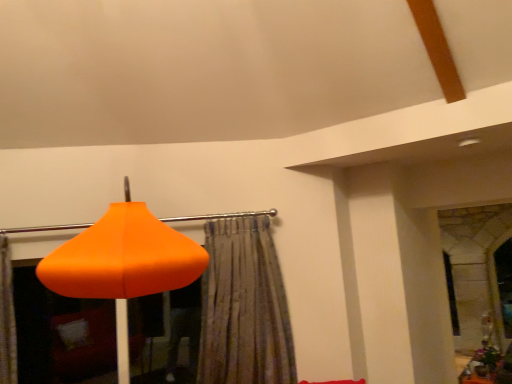
Question: Considering the relative sizes of orange matte lampshade at lower left and textured beige curtain at center in the image provided, is orange matte lampshade at lower left thinner than textured beige curtain at center?

Choices:
 (A) no
 (B) yes

Answer: (A)

Question: From the image's perspective, does orange matte lampshade at lower left appear lower than textured beige curtain at center?

Choices:
 (A) no
 (B) yes

Answer: (A)

Question: Is orange matte lampshade at lower left looking in the opposite direction of textured beige curtain at center?

Choices:
 (A) no
 (B) yes

Answer: (A)

Question: Are orange matte lampshade at lower left and textured beige curtain at center located far from each other?

Choices:
 (A) no
 (B) yes

Answer: (B)

Question: Does orange matte lampshade at lower left contain textured beige curtain at center?

Choices:
 (A) yes
 (B) no

Answer: (A)

Question: Is orange matte lampshade at lower left in front of or behind wooden textured table at lower right in the image?

Choices:
 (A) front
 (B) behind

Answer: (A)

Question: From the image's perspective, is orange matte lampshade at lower left located above or below wooden textured table at lower right?

Choices:
 (A) above
 (B) below

Answer: (A)

Question: Is orange matte lampshade at lower left wider or thinner than wooden textured table at lower right?

Choices:
 (A) thin
 (B) wide

Answer: (B)

Question: Would you say orange matte lampshade at lower left is to the left or to the right of wooden textured table at lower right in the picture?

Choices:
 (A) left
 (B) right

Answer: (A)

Question: From a real-world perspective, is wooden textured table at lower right above or below textured beige curtain at center?

Choices:
 (A) below
 (B) above

Answer: (A)

Question: Is point (468, 377) closer or farther from the camera than point (245, 271)?

Choices:
 (A) farther
 (B) closer

Answer: (A)

Question: Is wooden textured table at lower right bigger or smaller than textured beige curtain at center?

Choices:
 (A) small
 (B) big

Answer: (B)

Question: From their relative heights in the image, would you say wooden textured table at lower right is taller or shorter than textured beige curtain at center?

Choices:
 (A) short
 (B) tall

Answer: (A)

Question: In terms of width, does wooden textured table at lower right look wider or thinner when compared to orange matte lampshade at lower left?

Choices:
 (A) thin
 (B) wide

Answer: (A)

Question: From a real-world perspective, is wooden textured table at lower right positioned above or below orange matte lampshade at lower left?

Choices:
 (A) below
 (B) above

Answer: (A)